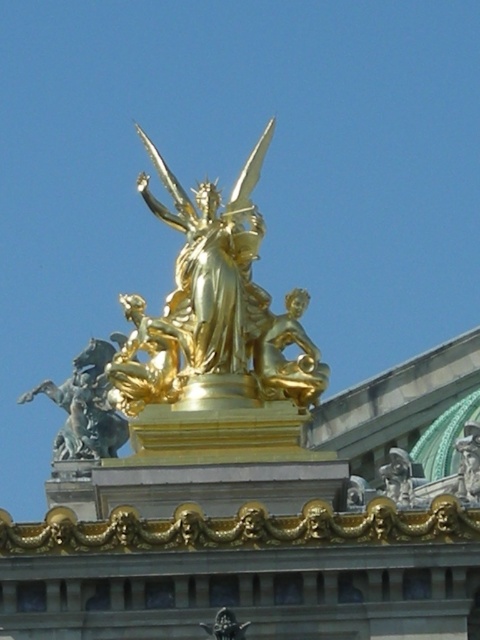
Question: Which object is positioned farthest from the shiny blue horse at left?

Choices:
 (A) gold metallic sword at center
 (B) gold polished statue at center

Answer: (A)

Question: From the image, what is the correct spatial relationship of shiny blue horse at left in relation to gold metallic sword at center?

Choices:
 (A) left
 (B) right

Answer: (A)

Question: Which of these objects is positioned farthest from the gold metallic sword at center?

Choices:
 (A) shiny blue horse at left
 (B) gold polished statue at center

Answer: (A)

Question: Can you confirm if shiny blue horse at left is positioned to the left of gold polished statue at center?

Choices:
 (A) no
 (B) yes

Answer: (B)

Question: Does shiny blue horse at left lie in front of gold polished statue at center?

Choices:
 (A) yes
 (B) no

Answer: (B)

Question: Which point is farther to the camera?

Choices:
 (A) 211,625
 (B) 285,365
 (C) 98,374

Answer: (C)